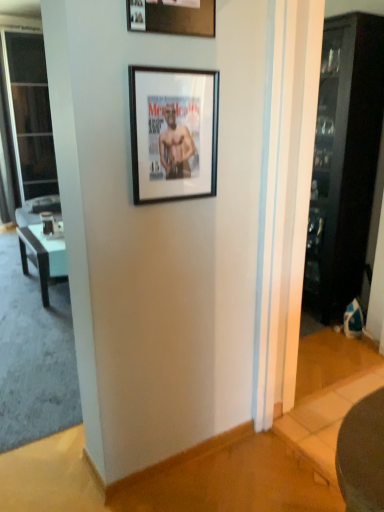
Find the location of `dark wood cabinet at right`. dark wood cabinet at right is located at coordinates (344, 162).

What is the approximate height of black matte picture frame at upper center, marked as the first picture frame in a bottom-to-top arrangement?

The height of black matte picture frame at upper center, marked as the first picture frame in a bottom-to-top arrangement, is 16.22 inches.

Measure the distance between transparent glass screen door at left and camera.

They are 4.97 meters apart.

Locate an element on the screen. The image size is (384, 512). wooden picture frame at upper center, which ranks as the 1th picture frame in top-to-bottom order is located at coordinates (172, 17).

How different are the orientations of transparent glass screen door at left and black matte picture frame at upper center, which is the 2th picture frame from top to bottom, in degrees?

The angular difference between transparent glass screen door at left and black matte picture frame at upper center, which is the 2th picture frame from top to bottom, is 0.977 degrees.

Which object is positioned more to the right, transparent glass screen door at left or black matte picture frame at upper center, which is the 2th picture frame from top to bottom?

black matte picture frame at upper center, which is the 2th picture frame from top to bottom, is more to the right.

In the scene shown: From a real-world perspective, is transparent glass screen door at left over black matte picture frame at upper center, marked as the first picture frame in a bottom-to-top arrangement?

No.

Considering the sizes of objects transparent glass screen door at left and black matte picture frame at upper center, which is the 2th picture frame from top to bottom, in the image provided, who is smaller, transparent glass screen door at left or black matte picture frame at upper center, which is the 2th picture frame from top to bottom,?

Smaller between the two is black matte picture frame at upper center, which is the 2th picture frame from top to bottom.

What's the angular difference between dark wood cabinet at right and wooden picture frame at upper center, positioned as the 2th picture frame in bottom-to-top order,'s facing directions?

They differ by 90.3 degrees in their facing directions.

Consider the image. Considering the relative sizes of dark wood cabinet at right and wooden picture frame at upper center, which ranks as the 1th picture frame in top-to-bottom order, in the image provided, is dark wood cabinet at right shorter than wooden picture frame at upper center, which ranks as the 1th picture frame in top-to-bottom order,?

Incorrect, the height of dark wood cabinet at right does not fall short of that of wooden picture frame at upper center, which ranks as the 1th picture frame in top-to-bottom order.

Looking at this image, from the image's perspective, is dark wood cabinet at right under wooden picture frame at upper center, positioned as the 2th picture frame in bottom-to-top order?

Indeed, from the image's perspective, dark wood cabinet at right is shown beneath wooden picture frame at upper center, positioned as the 2th picture frame in bottom-to-top order.

Is dark wood cabinet at right far from wooden picture frame at upper center, which ranks as the 1th picture frame in top-to-bottom order?

Yes, dark wood cabinet at right and wooden picture frame at upper center, which ranks as the 1th picture frame in top-to-bottom order, are located far from each other.

Does black matte picture frame at upper center, which is the 2th picture frame from top to bottom, turn towards transparent glass screen door at left?

No, black matte picture frame at upper center, which is the 2th picture frame from top to bottom, does not turn towards transparent glass screen door at left.

In terms of height, does black matte picture frame at upper center, which is the 2th picture frame from top to bottom, look taller or shorter compared to transparent glass screen door at left?

In the image, black matte picture frame at upper center, which is the 2th picture frame from top to bottom, appears to be shorter than transparent glass screen door at left.

Which of these two, black matte picture frame at upper center, which is the 2th picture frame from top to bottom, or transparent glass screen door at left, is smaller?

Smaller between the two is black matte picture frame at upper center, which is the 2th picture frame from top to bottom.

Considering the positions of objects wooden picture frame at upper center, which ranks as the 1th picture frame in top-to-bottom order, and black matte picture frame at upper center, marked as the first picture frame in a bottom-to-top arrangement, in the image provided, who is behind, wooden picture frame at upper center, which ranks as the 1th picture frame in top-to-bottom order, or black matte picture frame at upper center, marked as the first picture frame in a bottom-to-top arrangement,?

Positioned behind is black matte picture frame at upper center, marked as the first picture frame in a bottom-to-top arrangement.

Which is behind, point (157, 23) or point (207, 185)?

Point (207, 185)

Based on the photo, which is correct: wooden picture frame at upper center, which ranks as the 1th picture frame in top-to-bottom order, is inside black matte picture frame at upper center, which is the 2th picture frame from top to bottom, or outside of it?

wooden picture frame at upper center, which ranks as the 1th picture frame in top-to-bottom order, is outside black matte picture frame at upper center, which is the 2th picture frame from top to bottom.

Which object is thinner, wooden picture frame at upper center, which ranks as the 1th picture frame in top-to-bottom order, or black matte picture frame at upper center, which is the 2th picture frame from top to bottom?

Thinner between the two is black matte picture frame at upper center, which is the 2th picture frame from top to bottom.

Can you confirm if black matte picture frame at upper center, marked as the first picture frame in a bottom-to-top arrangement, is positioned to the left of dark wood cabinet at right?

Yes, black matte picture frame at upper center, marked as the first picture frame in a bottom-to-top arrangement, is to the left of dark wood cabinet at right.

Would you say black matte picture frame at upper center, marked as the first picture frame in a bottom-to-top arrangement, is outside dark wood cabinet at right?

Yes, black matte picture frame at upper center, marked as the first picture frame in a bottom-to-top arrangement, is outside of dark wood cabinet at right.

Considering the positions of objects black matte picture frame at upper center, which is the 2th picture frame from top to bottom, and dark wood cabinet at right in the image provided, who is behind, black matte picture frame at upper center, which is the 2th picture frame from top to bottom, or dark wood cabinet at right?

Positioned behind is dark wood cabinet at right.

Is black matte picture frame at upper center, which is the 2th picture frame from top to bottom, directly adjacent to dark wood cabinet at right?

No, black matte picture frame at upper center, which is the 2th picture frame from top to bottom, is not with dark wood cabinet at right.

Looking at their sizes, would you say black matte picture frame at upper center, marked as the first picture frame in a bottom-to-top arrangement, is wider or thinner than black glossy table at left?

black matte picture frame at upper center, marked as the first picture frame in a bottom-to-top arrangement, is thinner than black glossy table at left.

Looking at this image, measure the distance between black matte picture frame at upper center, which is the 2th picture frame from top to bottom, and black glossy table at left.

black matte picture frame at upper center, which is the 2th picture frame from top to bottom, is 6.65 feet away from black glossy table at left.

From a real-world perspective, who is located lower, black matte picture frame at upper center, which is the 2th picture frame from top to bottom, or black glossy table at left?

black glossy table at left is physically lower.

Is black matte picture frame at upper center, marked as the first picture frame in a bottom-to-top arrangement, positioned in front of black glossy table at left?

Yes, black matte picture frame at upper center, marked as the first picture frame in a bottom-to-top arrangement, is closer to the camera.

From a real-world perspective, is dark wood cabinet at right above or below black glossy table at left?

In terms of real-world spatial position, dark wood cabinet at right is above black glossy table at left.

Is dark wood cabinet at right closer to camera compared to black glossy table at left?

Yes, dark wood cabinet at right is closer to the camera.

Is dark wood cabinet at right facing away from black glossy table at left?

That's not correct — dark wood cabinet at right is not looking away from black glossy table at left.

The image size is (384, 512). What are the coordinates of `screen door lying behind the black matte picture frame at upper center, which is the 2th picture frame from top to bottom` in the screenshot? It's located at (29, 113).

Where is `cabinetry below the wooden picture frame at upper center, positioned as the 2th picture frame in bottom-to-top order (from the image's perspective)`? cabinetry below the wooden picture frame at upper center, positioned as the 2th picture frame in bottom-to-top order (from the image's perspective) is located at coordinates (344, 162).

Which object lies nearer to the anchor point black matte picture frame at upper center, which is the 2th picture frame from top to bottom, transparent glass screen door at left or dark wood cabinet at right?

dark wood cabinet at right is closer to black matte picture frame at upper center, which is the 2th picture frame from top to bottom.

When comparing their distances from wooden picture frame at upper center, which ranks as the 1th picture frame in top-to-bottom order, does transparent glass screen door at left or black matte picture frame at upper center, marked as the first picture frame in a bottom-to-top arrangement, seem closer?

black matte picture frame at upper center, marked as the first picture frame in a bottom-to-top arrangement, is closer to wooden picture frame at upper center, which ranks as the 1th picture frame in top-to-bottom order.

Based on their spatial positions, is black glossy table at left or dark wood cabinet at right closer to black matte picture frame at upper center, marked as the first picture frame in a bottom-to-top arrangement?

dark wood cabinet at right.

Looking at the image, which one is located further to dark wood cabinet at right, transparent glass screen door at left or black glossy table at left?

Among the two, transparent glass screen door at left is located further to dark wood cabinet at right.

When comparing their distances from dark wood cabinet at right, does wooden picture frame at upper center, which ranks as the 1th picture frame in top-to-bottom order, or black glossy table at left seem further?

black glossy table at left is positioned further to the anchor dark wood cabinet at right.

Estimate the real-world distances between objects in this image. Which object is closer to black glossy table at left, black matte picture frame at upper center, which is the 2th picture frame from top to bottom, or wooden picture frame at upper center, positioned as the 2th picture frame in bottom-to-top order?

black matte picture frame at upper center, which is the 2th picture frame from top to bottom, lies closer to black glossy table at left than the other object.

Estimate the real-world distances between objects in this image. Which object is further from black matte picture frame at upper center, which is the 2th picture frame from top to bottom, dark wood cabinet at right or black glossy table at left?

The object further to black matte picture frame at upper center, which is the 2th picture frame from top to bottom, is black glossy table at left.

From the image, which object appears to be farther from black matte picture frame at upper center, marked as the first picture frame in a bottom-to-top arrangement, transparent glass screen door at left or black glossy table at left?

transparent glass screen door at left is positioned further to the anchor black matte picture frame at upper center, marked as the first picture frame in a bottom-to-top arrangement.

At what (x,y) coordinates should I click in order to perform the action: click on cabinetry between wooden picture frame at upper center, positioned as the 2th picture frame in bottom-to-top order, and transparent glass screen door at left, along the z-axis. Please return your answer as a coordinate pair (x, y). This screenshot has height=512, width=384. Looking at the image, I should click on (344, 162).

In order to click on picture frame between wooden picture frame at upper center, which ranks as the 1th picture frame in top-to-bottom order, and transparent glass screen door at left from front to back in this screenshot , I will do `click(173, 133)`.

Locate an element on the screen. The image size is (384, 512). picture frame positioned between wooden picture frame at upper center, which ranks as the 1th picture frame in top-to-bottom order, and black glossy table at left from near to far is located at coordinates [173, 133].

Locate an element on the screen. The height and width of the screenshot is (512, 384). table between transparent glass screen door at left and dark wood cabinet at right in the horizontal direction is located at coordinates (43, 256).